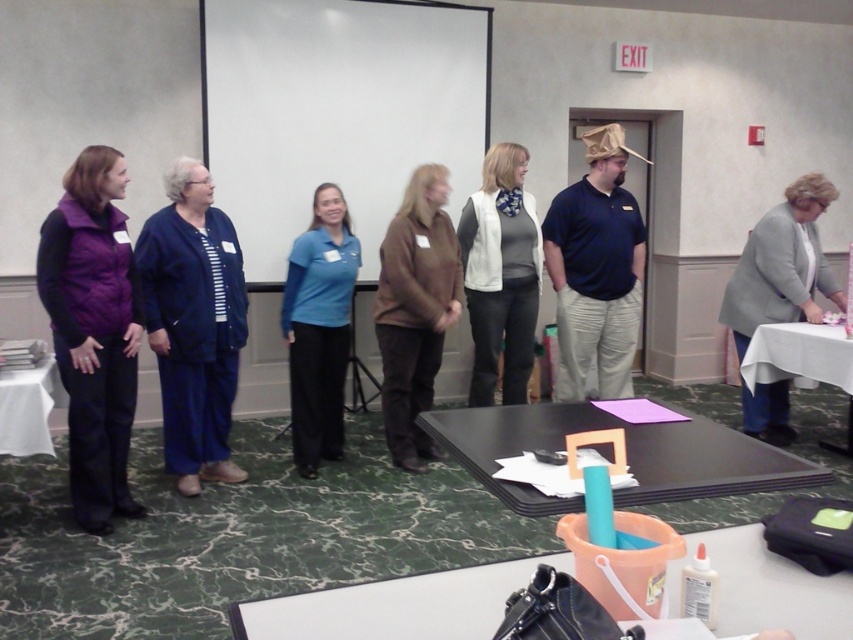
Question: Is white matte vest at center bigger than white cloth-covered table at right?

Choices:
 (A) yes
 (B) no

Answer: (A)

Question: Which of the following is the farthest from the observer?

Choices:
 (A) (219, 444)
 (B) (65, 321)

Answer: (A)

Question: Estimate the real-world distances between objects in this image. Which object is closer to the blue fabric pants at center?

Choices:
 (A) white cloth-covered table at lower left
 (B) white matte projection screen at upper center

Answer: (A)

Question: Is purple fleece vest at left to the right of white matte vest at center from the viewer's perspective?

Choices:
 (A) no
 (B) yes

Answer: (A)

Question: Does purple fleece vest at left have a smaller size compared to gray woolen jacket at right?

Choices:
 (A) no
 (B) yes

Answer: (B)

Question: Estimate the real-world distances between objects in this image. Which object is closer to the blue cotton shirt at center?

Choices:
 (A) purple fleece vest at left
 (B) white cloth-covered table at lower left
 (C) matte blue shirt at center
 (D) white cloth-covered table at right

Answer: (D)